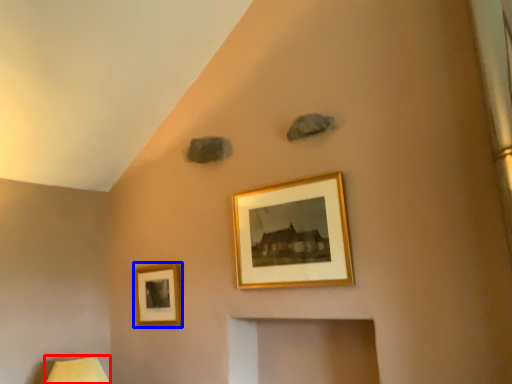
Question: Which object appears farthest to the camera in this image, table lamp (highlighted by a red box) or picture frame (highlighted by a blue box)?

Choices:
 (A) table lamp
 (B) picture frame

Answer: (B)